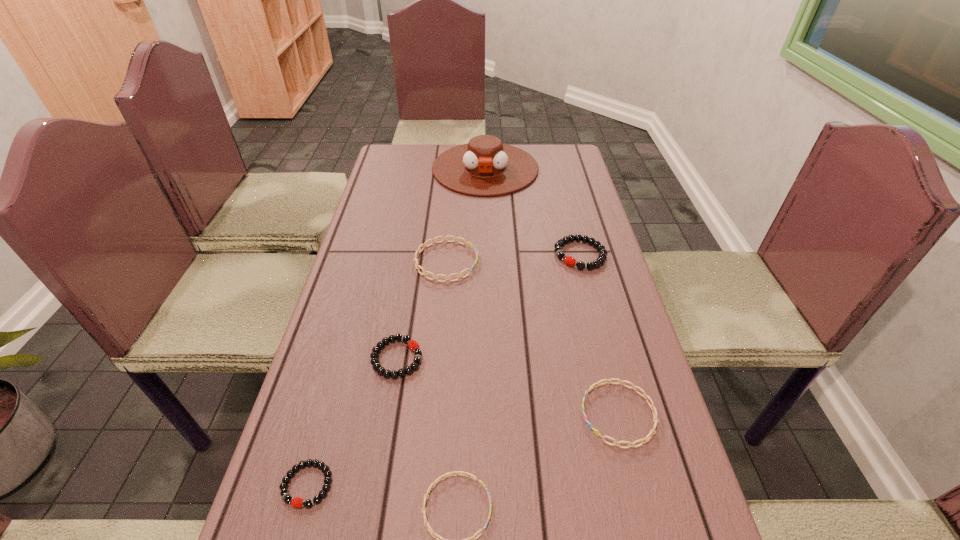
You are a GUI agent. You are given a task and a screenshot of the screen. Output one action in this format:
    pyautogui.click(x=<x>, y=<y>)
    Task: Click on the cowboy hat that is positioned at the right edge
    This screenshot has height=540, width=960.
    Given the screenshot: What is the action you would take?
    pyautogui.click(x=484, y=166)

The width and height of the screenshot is (960, 540). I want to click on object at the far right corner, so click(484, 166).

Where is `vacant space at the left edge`? The image size is (960, 540). vacant space at the left edge is located at coordinates (393, 227).

In order to click on vacant area at the right edge in this screenshot , I will do `click(553, 201)`.

Where is `vacant area at the far left corner`? vacant area at the far left corner is located at coordinates (426, 152).

You are a GUI agent. You are given a task and a screenshot of the screen. Output one action in this format:
    pyautogui.click(x=<x>, y=<y>)
    Task: Click on the free spot between the biggest blue bracelet and the leftmost object
    This screenshot has height=540, width=960.
    Given the screenshot: What is the action you would take?
    pyautogui.click(x=376, y=373)

This screenshot has height=540, width=960. I want to click on free space between the farthest object and the fourth farthest bracelet, so click(x=552, y=292).

I want to click on unoccupied position between the second nearest black bracelet and the farthest blue bracelet, so click(x=421, y=309).

Where is `vacant space that is in between the farthest blue bracelet and the cowboy hat`? vacant space that is in between the farthest blue bracelet and the cowboy hat is located at coordinates (466, 215).

Select which object is the third closest to the biggest blue bracelet. Please provide its 2D coordinates. Your answer should be formatted as a tuple, i.e. [(x, y)], where the tuple contains the x and y coordinates of a point satisfying the conditions above.

[(484, 166)]